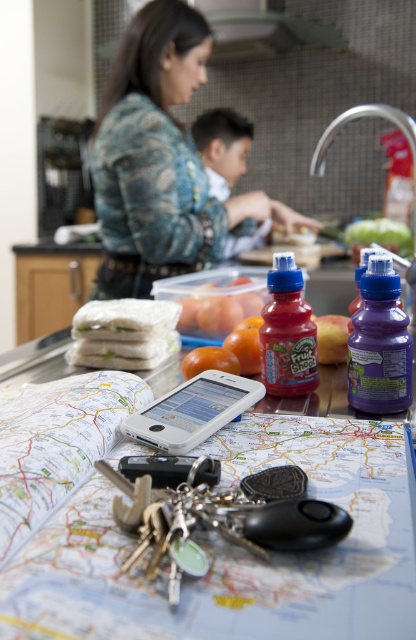
You are organizing a kitchen pantry and need to place the blue textured shirt at upper left and the translucent plastic container at center into a shelf. The shelf is only wide enough to accommodate the narrower of the two items. Which item should you place first to ensure it fits?

The translucent plastic container at center should be placed first because the blue textured shirt at upper left is wider, so starting with the narrower item ensures it will fit on the shelf.

You are a delivery person who needs to place a package on the counter where the blue textured shirt at upper left and the smooth tomato at center are located. The package requires a minimum of 40 inches of space between the shirt and the tomato to fit. Can you fit the package there?

The blue textured shirt at upper left is 37.71 inches away from the smooth tomato at center, which is less than the required 40 inches. Therefore, the package cannot be placed there.

You are a chef preparing a meal and need to choose a container to hold hot water. You have the purple plastic bottle at center and the silver metallic faucet at upper right. Which one is more suitable for holding hot water?

The silver metallic faucet at upper right is more suitable for holding hot water because it is made of metal, which conducts heat better than plastic. However, the purple plastic bottle at center is shorter than the silver metallic faucet at upper right, so it might not be the best choice for this purpose.